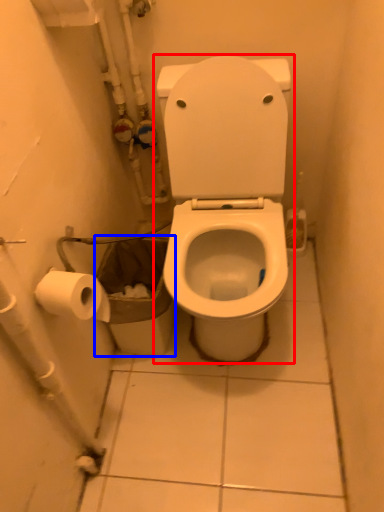
Question: Which point is further to the camera, toilet (highlighted by a red box) or garbage (highlighted by a blue box)?

Choices:
 (A) toilet
 (B) garbage

Answer: (B)